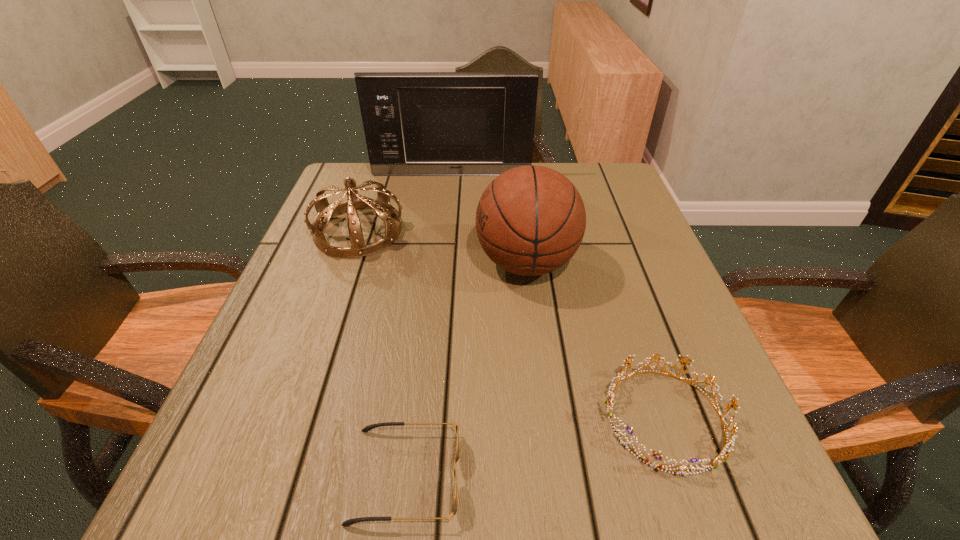
The width and height of the screenshot is (960, 540). In order to click on the farthest object in this screenshot , I will do `click(416, 123)`.

At what (x,y) coordinates should I click in order to perform the action: click on the tallest object. Please return your answer as a coordinate pair (x, y). This screenshot has height=540, width=960. Looking at the image, I should click on (416, 123).

Locate an element on the screen. basketball is located at coordinates (530, 220).

Where is `the third shortest object`? the third shortest object is located at coordinates (381, 205).

Identify the location of the taller tiara. (381, 205).

Identify the location of the second shortest object. The height and width of the screenshot is (540, 960). (722, 457).

Where is `the right tiara`? the right tiara is located at coordinates (722, 457).

You are a GUI agent. You are given a task and a screenshot of the screen. Output one action in this format:
    pyautogui.click(x=<x>, y=<y>)
    Task: Click on the shortest object
    
    Given the screenshot: What is the action you would take?
    pyautogui.click(x=349, y=522)

The height and width of the screenshot is (540, 960). I want to click on vacant space situated on the front panel of the farthest object, so click(449, 197).

You are a GUI agent. You are given a task and a screenshot of the screen. Output one action in this format:
    pyautogui.click(x=<x>, y=<y>)
    Task: Click on the free location located 0.140m on the side with brand label of the second tallest object
    Image resolution: width=960 pixels, height=540 pixels.
    Given the screenshot: What is the action you would take?
    coord(412,263)